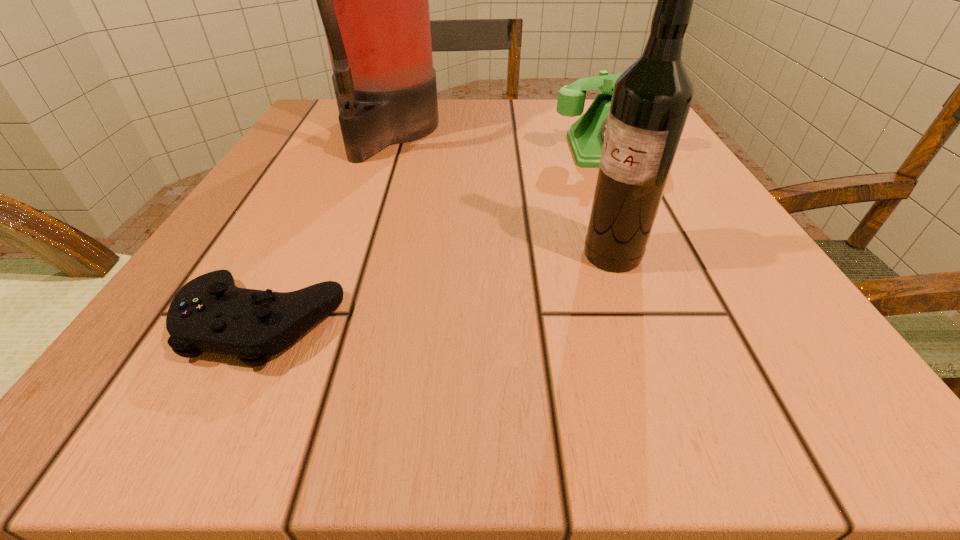
Find the location of a particular element. The image size is (960, 540). free space located on the dial of the second shortest object is located at coordinates [647, 229].

You are a GUI agent. You are given a task and a screenshot of the screen. Output one action in this format:
    pyautogui.click(x=<x>, y=<y>)
    Task: Click on the free space located on the right of the shortest object
    Image resolution: width=960 pixels, height=540 pixels.
    Given the screenshot: What is the action you would take?
    pyautogui.click(x=392, y=322)

You are a GUI agent. You are given a task and a screenshot of the screen. Output one action in this format:
    pyautogui.click(x=<x>, y=<y>)
    Task: Click on the fire extinguisher located in the far edge section of the desktop
    The width and height of the screenshot is (960, 540).
    Given the screenshot: What is the action you would take?
    pyautogui.click(x=373, y=0)

Image resolution: width=960 pixels, height=540 pixels. I want to click on telephone located at the far edge, so click(586, 136).

Identify the location of object positioned at the near edge. This screenshot has height=540, width=960. (210, 313).

In order to click on fire extinguisher at the left edge in this screenshot , I will do `click(373, 0)`.

The width and height of the screenshot is (960, 540). Identify the location of control that is at the left edge. (210, 313).

Where is `wine bottle located at the right edge`? This screenshot has height=540, width=960. wine bottle located at the right edge is located at coordinates (651, 100).

The image size is (960, 540). I want to click on telephone located at the right edge, so click(586, 136).

You are a GUI agent. You are given a task and a screenshot of the screen. Output one action in this format:
    pyautogui.click(x=<x>, y=<y>)
    Task: Click on the object that is at the far left corner
    This screenshot has width=960, height=540.
    Given the screenshot: What is the action you would take?
    pyautogui.click(x=373, y=0)